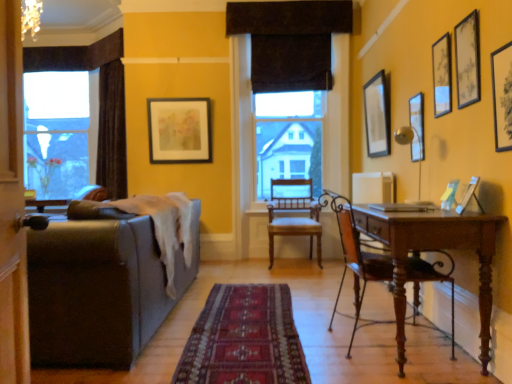
Question: Should I look upward or downward to see brown fabric curtain at upper center?

Choices:
 (A) down
 (B) up

Answer: (B)

Question: Can you confirm if brown wood chair at right, which appears as the 2th chair when viewed from the back, is bigger than wooden chair at center, which is the first chair in back-to-front order?

Choices:
 (A) yes
 (B) no

Answer: (B)

Question: Can you confirm if brown wood chair at right, which is the 1th chair from front to back, is shorter than wooden chair at center, positioned as the 2th chair in front-to-back order?

Choices:
 (A) yes
 (B) no

Answer: (A)

Question: Does brown wood chair at right, which is the 1th chair from front to back, have a greater width compared to wooden chair at center, positioned as the 2th chair in front-to-back order?

Choices:
 (A) no
 (B) yes

Answer: (B)

Question: Is brown wood chair at right, which is the 1th chair from front to back, turned away from wooden chair at center, which is the first chair in back-to-front order?

Choices:
 (A) yes
 (B) no

Answer: (B)

Question: Does brown wood chair at right, which appears as the 2th chair when viewed from the back, appear on the left side of wooden chair at center, positioned as the 2th chair in front-to-back order?

Choices:
 (A) yes
 (B) no

Answer: (B)

Question: From the image's perspective, does brown wood chair at right, which appears as the 2th chair when viewed from the back, appear lower than wooden chair at center, positioned as the 2th chair in front-to-back order?

Choices:
 (A) yes
 (B) no

Answer: (A)

Question: Does matte black picture frame at upper right, which ranks as the third picture frame in left-to-right order, turn towards carpeted rug at center?

Choices:
 (A) no
 (B) yes

Answer: (A)

Question: Is matte black picture frame at upper right, which ranks as the seventh picture frame in back-to-front order, at the right side of carpeted rug at center?

Choices:
 (A) yes
 (B) no

Answer: (A)

Question: Is matte black picture frame at upper right, which ranks as the seventh picture frame in back-to-front order, further to camera compared to carpeted rug at center?

Choices:
 (A) no
 (B) yes

Answer: (A)

Question: Is matte black picture frame at upper right, which ranks as the seventh picture frame in back-to-front order, wider than carpeted rug at center?

Choices:
 (A) yes
 (B) no

Answer: (B)

Question: From the image's perspective, would you say matte black picture frame at upper right, acting as the 1th picture frame starting from the front, is positioned over carpeted rug at center?

Choices:
 (A) no
 (B) yes

Answer: (B)

Question: Is the surface of matte black picture frame at upper right, which ranks as the seventh picture frame in back-to-front order, in direct contact with carpeted rug at center?

Choices:
 (A) no
 (B) yes

Answer: (A)

Question: Is matte black picture frame at upper right, which is the 5th picture frame from back to front, aimed at matte black picture frame at upper center, the 1th picture frame from the left?

Choices:
 (A) no
 (B) yes

Answer: (A)